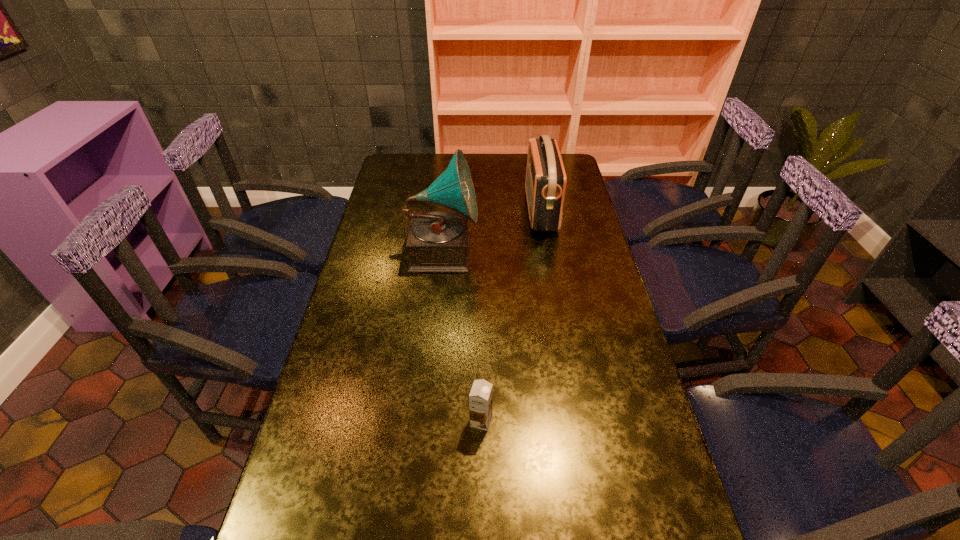
Identify the location of object at the right edge. This screenshot has width=960, height=540. (545, 184).

Locate an element on the screen. free region at the left edge of the desktop is located at coordinates (369, 242).

Where is `vacant region at the right edge`? The height and width of the screenshot is (540, 960). vacant region at the right edge is located at coordinates (610, 307).

Identify the location of vacant region between the radio receiver and the tallest object. This screenshot has height=540, width=960. (492, 231).

The height and width of the screenshot is (540, 960). I want to click on free space between the radio receiver and the shortest object, so click(x=511, y=315).

Locate an element on the screen. This screenshot has width=960, height=540. free space that is in between the radio receiver and the record player is located at coordinates (492, 231).

Where is `vacant area between the tallest object and the nearest object`? This screenshot has width=960, height=540. vacant area between the tallest object and the nearest object is located at coordinates (462, 336).

At what (x,y) coordinates should I click in order to perform the action: click on free area in between the rightmost object and the shortest object. Please return your answer as a coordinate pair (x, y). This screenshot has height=540, width=960. Looking at the image, I should click on (511, 315).

Locate an element on the screen. unoccupied area between the radio receiver and the record player is located at coordinates (492, 231).

Find the location of a particular element. Image resolution: width=960 pixels, height=540 pixels. the closest object to the tallest object is located at coordinates (545, 184).